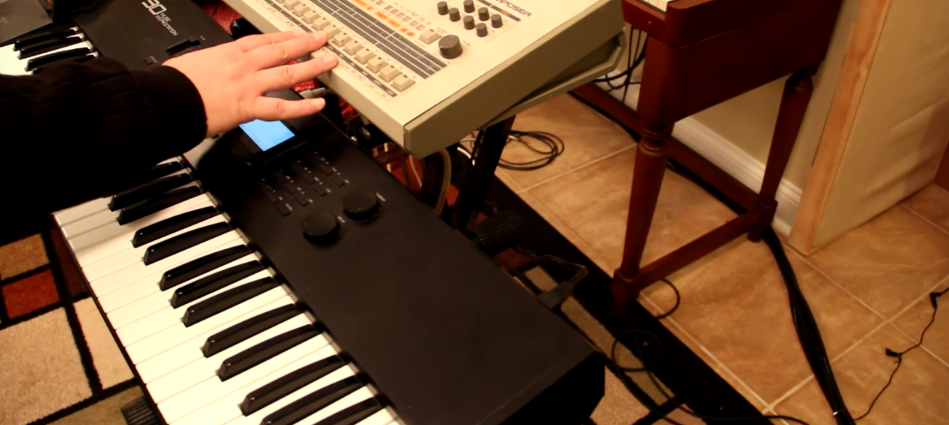
This screenshot has height=425, width=949. In order to click on grey knob in this screenshot , I will do `click(448, 46)`, `click(479, 26)`, `click(467, 22)`, `click(452, 13)`, `click(438, 11)`, `click(495, 18)`, `click(479, 13)`, `click(467, 9)`.